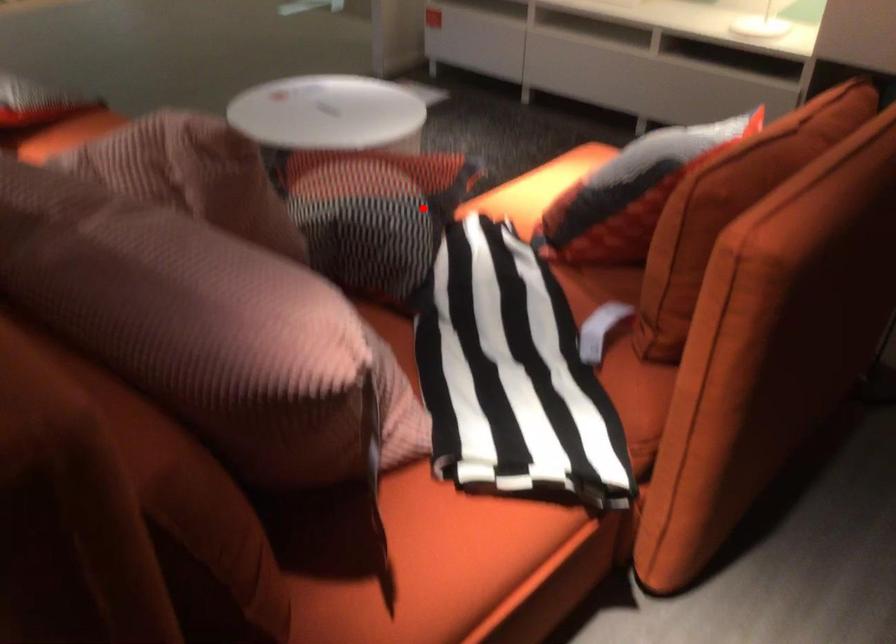
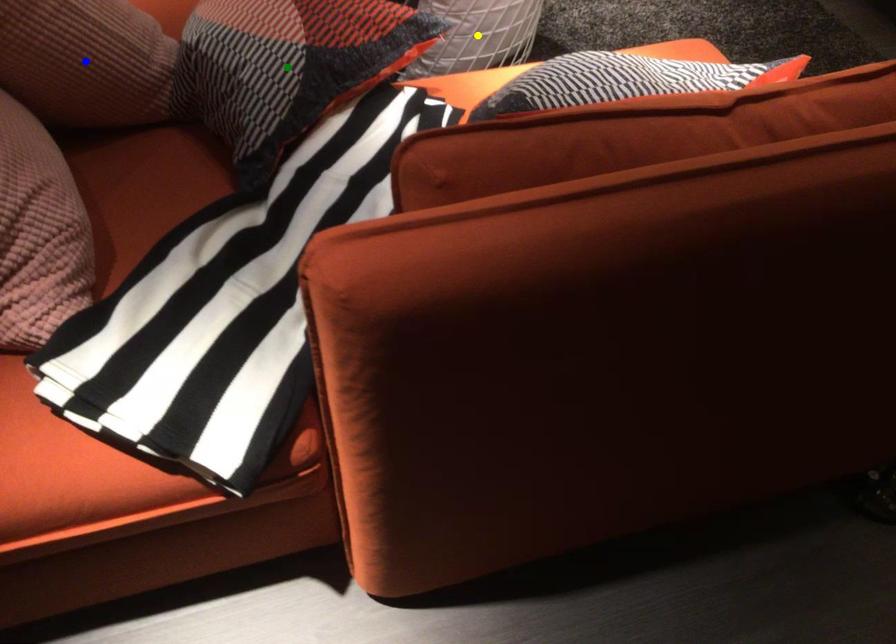
Question: I am providing you with two images of the same scene from different viewpoints. A red point is marked on the first image. You are given multiple points on the second image. Which mark in image 2 goes with the point in image 1?

Choices:
 (A) blue point
 (B) yellow point
 (C) green point

Answer: (C)